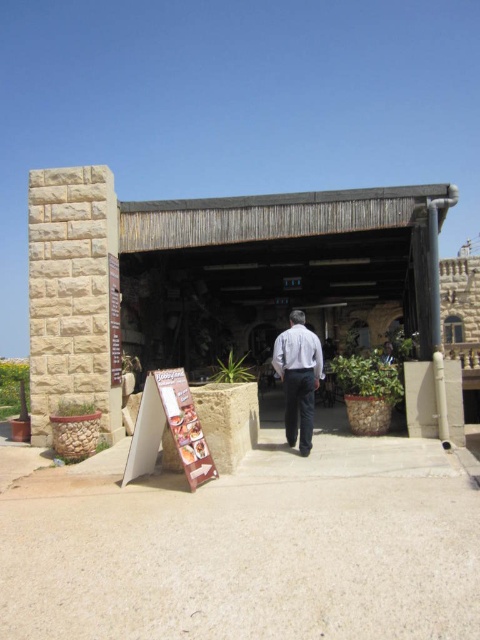
Question: Considering the relative positions of brown cardboard sign at center and white matte shirt at center in the image provided, where is brown cardboard sign at center located with respect to white matte shirt at center?

Choices:
 (A) below
 (B) above

Answer: (A)

Question: Which object is closer to the camera taking this photo?

Choices:
 (A) brown cardboard sign at center
 (B) white matte shirt at center
 (C) white cotton shirt at center

Answer: (A)

Question: Is white cotton shirt at center above brown cardboard sign at center?

Choices:
 (A) yes
 (B) no

Answer: (A)

Question: Is white cotton shirt at center further to camera compared to brown cardboard sign at center?

Choices:
 (A) no
 (B) yes

Answer: (B)

Question: Which point appears closest to the camera in this image?

Choices:
 (A) (300, 355)
 (B) (165, 369)
 (C) (291, 358)

Answer: (A)

Question: Which of the following is the farthest from the observer?

Choices:
 (A) (276, 365)
 (B) (300, 422)

Answer: (B)